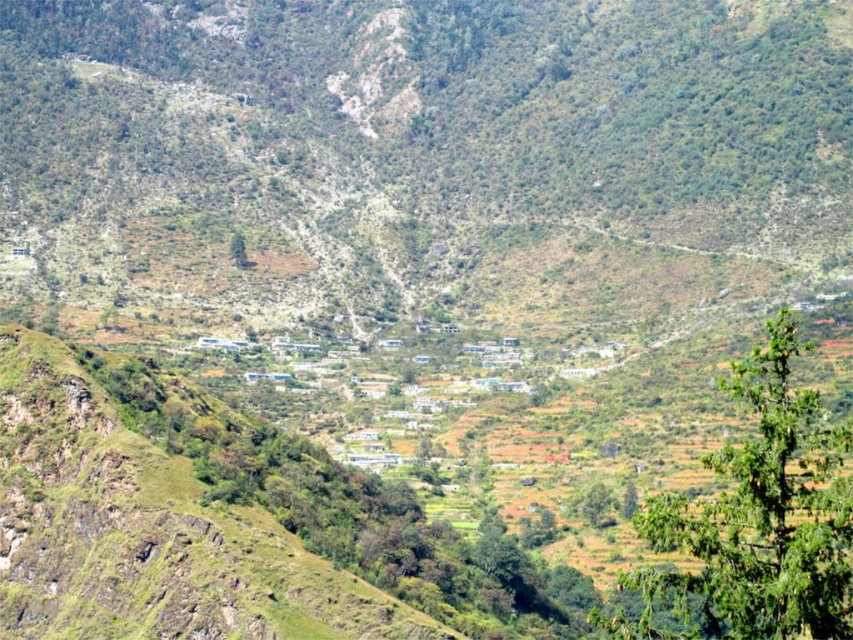
Question: Does green leafy tree at right have a smaller size compared to green leafy tree at center?

Choices:
 (A) no
 (B) yes

Answer: (A)

Question: Does green leafy tree at right have a greater width compared to green leafy tree at center?

Choices:
 (A) no
 (B) yes

Answer: (B)

Question: Which of the following is the closest to the observer?

Choices:
 (A) green leafy tree at center
 (B) green leafy tree at right

Answer: (B)

Question: Does green leafy tree at right appear on the left side of green leafy tree at center?

Choices:
 (A) yes
 (B) no

Answer: (B)